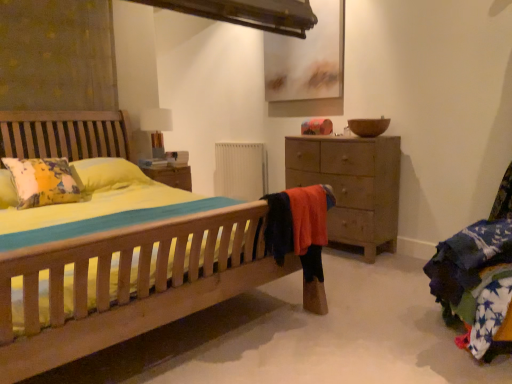
Identify the location of white matte radiator at center. The width and height of the screenshot is (512, 384). (240, 170).

What is the approximate width of wooden chest of drawers at right?

20.67 inches.

This screenshot has height=384, width=512. Find the location of `white fabric table lamp at upper center`. white fabric table lamp at upper center is located at coordinates (156, 127).

Are white fabric table lamp at upper center and wooden chest of drawers at right located far from each other?

Yes, white fabric table lamp at upper center and wooden chest of drawers at right are quite far apart.

Which object is positioned more to the right, white fabric table lamp at upper center or wooden chest of drawers at right?

wooden chest of drawers at right.

Is point (161, 142) in front of point (371, 185)?

No.

Would you say white fabric table lamp at upper center is outside wooden chest of drawers at right?

Absolutely, white fabric table lamp at upper center is external to wooden chest of drawers at right.

Is point (357, 143) farther from viewer compared to point (259, 186)?

No, (357, 143) is in front of (259, 186).

Can white matte radiator at center be found inside wooden chest of drawers at right?

No, white matte radiator at center is not inside wooden chest of drawers at right.

From the image's perspective, who appears lower, wooden chest of drawers at right or white matte radiator at center?

wooden chest of drawers at right appears lower in the image.

Is wooden chest of drawers at right aimed at white matte radiator at center?

No, wooden chest of drawers at right is not facing towards white matte radiator at center.

From a real-world perspective, is white matte radiator at center above or below wooden chest of drawers at right?

white matte radiator at center is above wooden chest of drawers at right.

Identify the location of radiator that is above the wooden chest of drawers at right (from the image's perspective). (240, 170).

Is white matte radiator at center oriented away from wooden chest of drawers at right?

No.

Is white matte radiator at center behind wooden chest of drawers at right?

Yes, it is.

What's the angular difference between white fabric table lamp at upper center and white matte radiator at center's facing directions?

There is a 86.7-degree angle between the facing directions of white fabric table lamp at upper center and white matte radiator at center.

From a real-world perspective, between white fabric table lamp at upper center and white matte radiator at center, who is vertically higher?

white fabric table lamp at upper center, from a real-world perspective.

Is white fabric table lamp at upper center not inside white matte radiator at center?

Absolutely, white fabric table lamp at upper center is external to white matte radiator at center.

Which of these two, white matte radiator at center or white fabric table lamp at upper center, is wider?

white fabric table lamp at upper center.

Does white matte radiator at center turn towards white fabric table lamp at upper center?

Yes.

What's the angular difference between white matte radiator at center and white fabric table lamp at upper center's facing directions?

The facing directions of white matte radiator at center and white fabric table lamp at upper center are 86.7 degrees apart.

From the image's perspective, does white matte radiator at center appear lower than white fabric table lamp at upper center?

Yes, from the image's perspective, white matte radiator at center is beneath white fabric table lamp at upper center.

Could you tell me if wooden chest of drawers at right is turned towards white fabric table lamp at upper center?

No, wooden chest of drawers at right is not turned towards white fabric table lamp at upper center.

From the picture: In terms of width, does wooden chest of drawers at right look wider or thinner when compared to white fabric table lamp at upper center?

wooden chest of drawers at right is wider than white fabric table lamp at upper center.

How different are the orientations of wooden chest of drawers at right and white fabric table lamp at upper center in degrees?

The facing directions of wooden chest of drawers at right and white fabric table lamp at upper center are 88.9 degrees apart.

Between wooden chest of drawers at right and white fabric table lamp at upper center, which one appears on the left side from the viewer's perspective?

white fabric table lamp at upper center is more to the left.

In the image, there is a wooden chest of drawers at right. Identify the location of table lamp above it (from the image's perspective). (156, 127).

Where is `radiator above the wooden chest of drawers at right (from a real-world perspective)`? The image size is (512, 384). radiator above the wooden chest of drawers at right (from a real-world perspective) is located at coordinates (240, 170).

Based on their spatial positions, is white matte radiator at center or wooden chest of drawers at right further from white fabric table lamp at upper center?

wooden chest of drawers at right is further to white fabric table lamp at upper center.

Which object lies nearer to the anchor point wooden chest of drawers at right, white fabric table lamp at upper center or white matte radiator at center?

The object closer to wooden chest of drawers at right is white matte radiator at center.

Looking at the image, which one is located further to wooden chest of drawers at right, white matte radiator at center or white fabric table lamp at upper center?

white fabric table lamp at upper center is further to wooden chest of drawers at right.

When comparing their distances from white matte radiator at center, does wooden chest of drawers at right or white fabric table lamp at upper center seem closer?

white fabric table lamp at upper center is closer to white matte radiator at center.

Based on their spatial positions, is wooden chest of drawers at right or white matte radiator at center further from white fabric table lamp at upper center?

wooden chest of drawers at right.

When comparing their distances from white matte radiator at center, does white fabric table lamp at upper center or wooden chest of drawers at right seem closer?

Based on the image, white fabric table lamp at upper center appears to be nearer to white matte radiator at center.

This screenshot has height=384, width=512. What are the coordinates of `radiator located between white fabric table lamp at upper center and wooden chest of drawers at right in the left-right direction` in the screenshot? It's located at (240, 170).